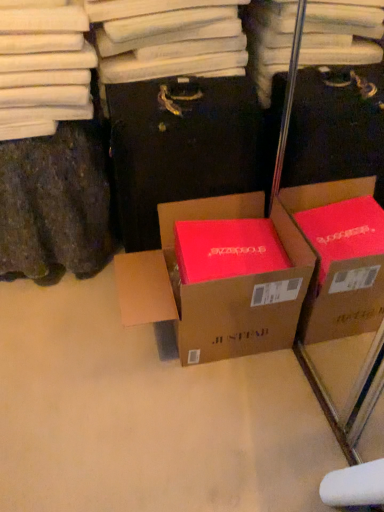
I want to click on blank area to the left of matte cardboard box at center, so click(x=64, y=352).